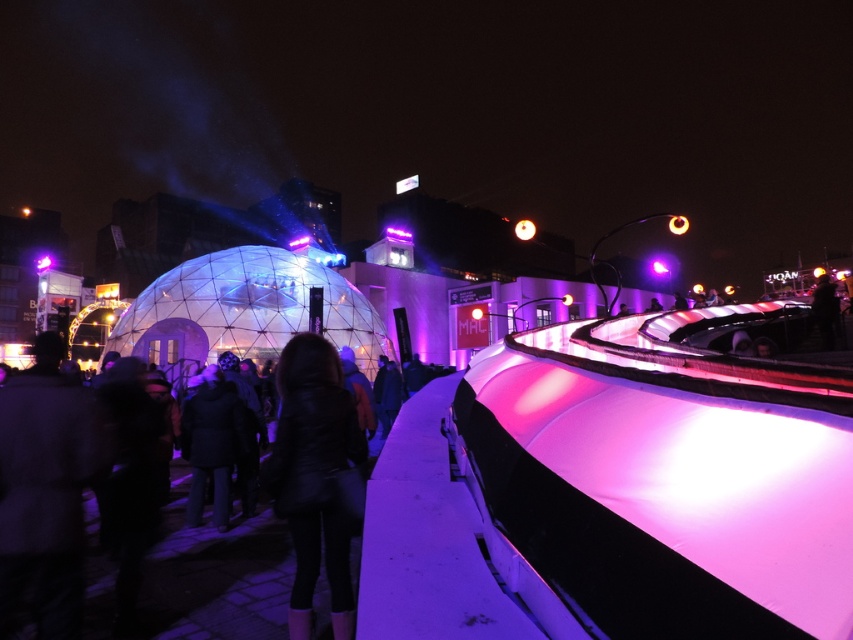
Who is taller, leather jacket at center or black leather jacket at center?

With more height is black leather jacket at center.

Which is more to the left, leather jacket at center or black leather jacket at center?

Positioned to the left is leather jacket at center.

Where is `leather jacket at center`? leather jacket at center is located at coordinates 215,573.

Measure the distance from black leather jacket at center to metallic sphere at center.

black leather jacket at center is 47.03 meters away from metallic sphere at center.

This screenshot has height=640, width=853. Find the location of `black leather jacket at center`. black leather jacket at center is located at coordinates pos(314,476).

From the picture: Which of these two, leather jacket at center or metallic sphere at center, stands taller?

metallic sphere at center is taller.

Which is behind, point (202, 520) or point (531, 228)?

Point (531, 228)

This screenshot has width=853, height=640. I want to click on leather jacket at center, so click(x=215, y=573).